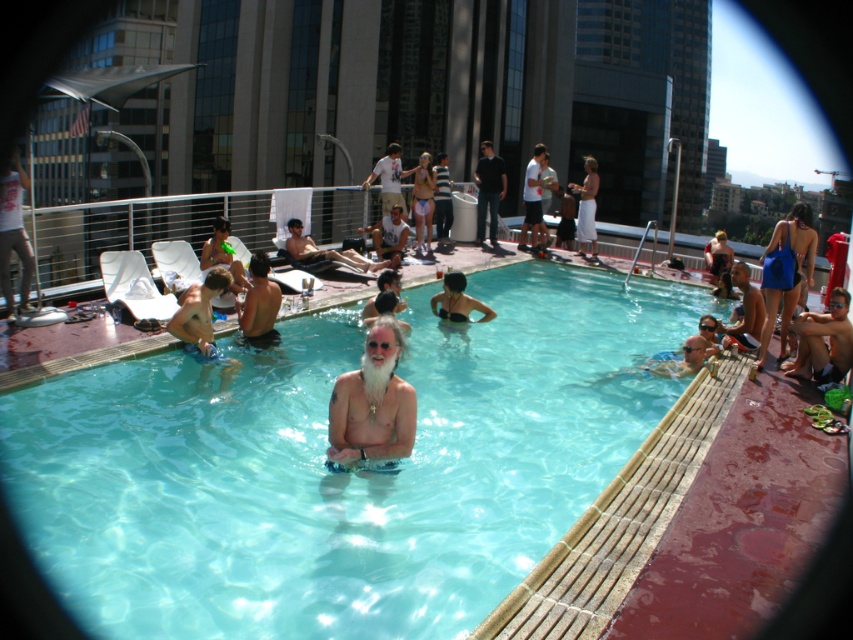
Is tan skin man at center smaller than beige fabric shorts at center?

Incorrect, tan skin man at center is not smaller in size than beige fabric shorts at center.

Does tan skin man at center have a lesser height compared to beige fabric shorts at center?

Indeed, tan skin man at center has a lesser height compared to beige fabric shorts at center.

Does point (318, 250) come farther from viewer compared to point (407, 234)?

No, it is not.

Locate an element on the screen. The image size is (853, 640). tan skin man at center is located at coordinates (326, 252).

Does beige fabric towel at lower left have a greater width compared to tan skin man at center?

In fact, beige fabric towel at lower left might be narrower than tan skin man at center.

Can you confirm if beige fabric towel at lower left is positioned to the right of tan skin man at center?

Incorrect, beige fabric towel at lower left is not on the right side of tan skin man at center.

Between point (207, 289) and point (293, 244), which one is positioned in front?

Point (207, 289) is in front.

Image resolution: width=853 pixels, height=640 pixels. I want to click on beige fabric towel at lower left, so click(x=202, y=326).

Is smooth tan skin at center to the right of dark blue jeans at center from the viewer's perspective?

Indeed, smooth tan skin at center is positioned on the right side of dark blue jeans at center.

Can you confirm if smooth tan skin at center is smaller than dark blue jeans at center?

Yes, smooth tan skin at center is smaller than dark blue jeans at center.

Find the location of a particular element. smooth tan skin at center is located at coordinates (744, 312).